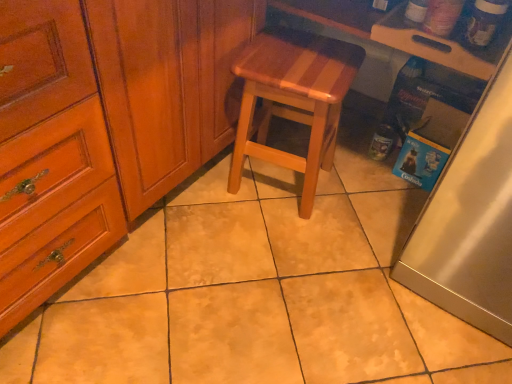
Find the location of a particular element. The width and height of the screenshot is (512, 384). free region on the left part of natural wood stool at center is located at coordinates (201, 193).